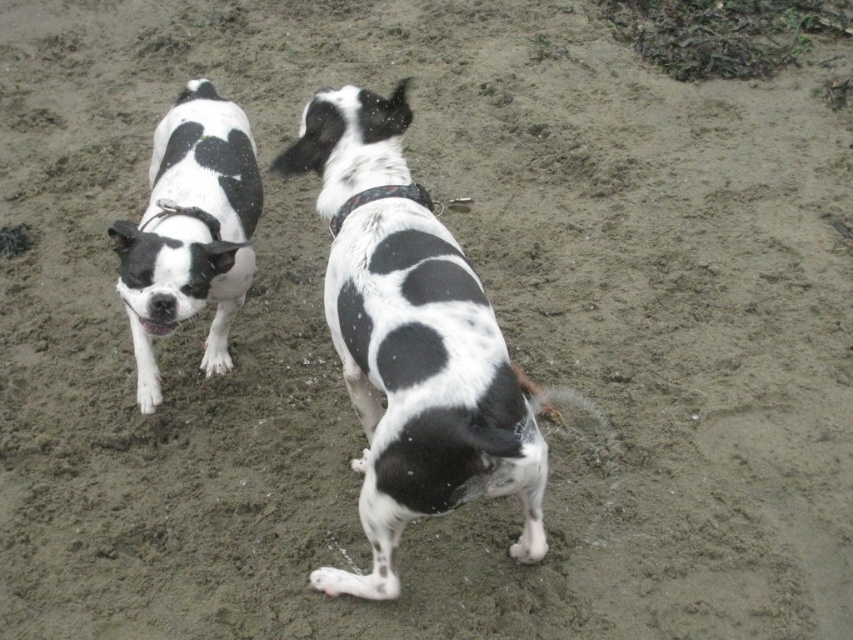
Can you confirm if black and white fur dog at center is positioned below black and white fur dog at left?

Yes.

Can you confirm if black and white fur dog at center is positioned to the right of black and white fur dog at left?

Yes, black and white fur dog at center is to the right of black and white fur dog at left.

The width and height of the screenshot is (853, 640). Describe the element at coordinates (424, 387) in the screenshot. I see `black and white fur dog at center` at that location.

Where is `black and white fur dog at center`? black and white fur dog at center is located at coordinates (424, 387).

Does black and white fur dog at left appear on the left side of black fabric collar at center?

Yes, black and white fur dog at left is to the left of black fabric collar at center.

Can you confirm if black and white fur dog at left is positioned to the right of black fabric collar at center?

No, black and white fur dog at left is not to the right of black fabric collar at center.

Measure the distance between point [221,144] and camera.

2.60 meters

Locate an element on the screen. black and white fur dog at left is located at coordinates (190, 230).

Which is in front, point (331, 195) or point (335, 224)?

Positioned in front is point (331, 195).

Is black and white fur dog at center wider than black fabric collar at center?

Indeed, black and white fur dog at center has a greater width compared to black fabric collar at center.

Is point (389, 246) farther from camera compared to point (386, 188)?

No, (389, 246) is in front of (386, 188).

The image size is (853, 640). In order to click on black and white fur dog at center in this screenshot , I will do `click(424, 387)`.